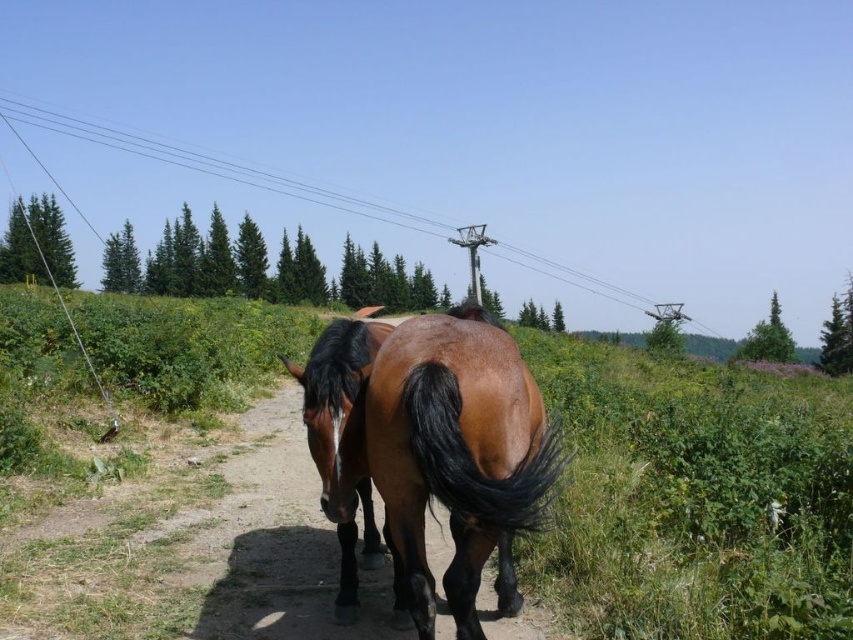
Question: Which is farther from the metallic wire at upper center?

Choices:
 (A) brown glossy tail at center
 (B) brown glossy horse at center

Answer: (A)

Question: Does brown glossy horse at center have a greater width compared to metallic wire at upper center?

Choices:
 (A) no
 (B) yes

Answer: (A)

Question: Is brown glossy horse at center below metallic wire at upper center?

Choices:
 (A) no
 (B) yes

Answer: (B)

Question: Estimate the real-world distances between objects in this image. Which object is closer to the metallic wire at upper center?

Choices:
 (A) brown glossy horse at center
 (B) brown glossy tail at center

Answer: (A)

Question: Which object is the farthest from the metallic wire at upper center?

Choices:
 (A) brown glossy tail at center
 (B) brown glossy horse at center

Answer: (A)

Question: Is brown glossy horse at center above metallic wire at upper center?

Choices:
 (A) yes
 (B) no

Answer: (B)